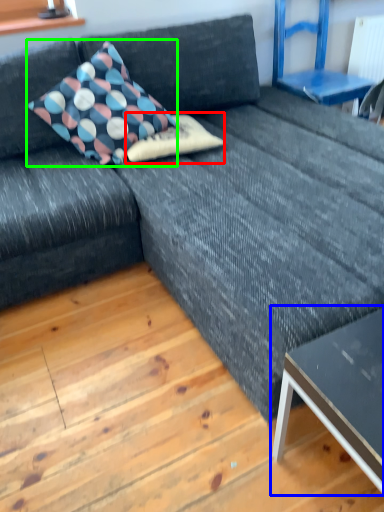
Question: Which object is positioned farthest from pillow (highlighted by a red box)? Select from table (highlighted by a blue box) and pillow (highlighted by a green box).

Choices:
 (A) table
 (B) pillow

Answer: (A)